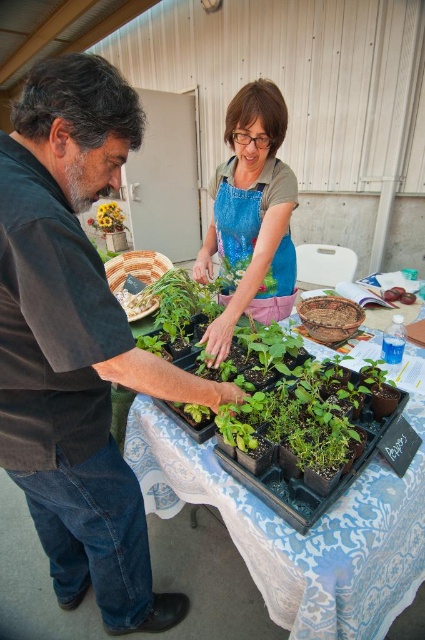
Which is more to the right, matte black shirt at left or green plastic tray at center?

green plastic tray at center is more to the right.

Which is in front, point (133, 593) or point (167, 445)?

Point (167, 445)

This screenshot has width=425, height=640. Identify the location of matte black shirt at left. (76, 342).

Image resolution: width=425 pixels, height=640 pixels. Find the location of `matte black shirt at left`. matte black shirt at left is located at coordinates (76, 342).

Who is higher up, matte black shirt at left or yellow matte flower at upper left?

Positioned higher is yellow matte flower at upper left.

Which is in front, point (107, 92) or point (118, 220)?

Positioned in front is point (107, 92).

Identify the location of matte black shirt at left. (76, 342).

Is matte black shirt at left shorter than blue fabric apron at center?

No, matte black shirt at left is not shorter than blue fabric apron at center.

Which is behind, point (8, 448) or point (266, 166)?

Positioned behind is point (266, 166).

Between point (176, 394) and point (277, 264), which one is positioned behind?

Positioned behind is point (277, 264).

Identify the location of matte black shirt at left. Image resolution: width=425 pixels, height=640 pixels. (76, 342).